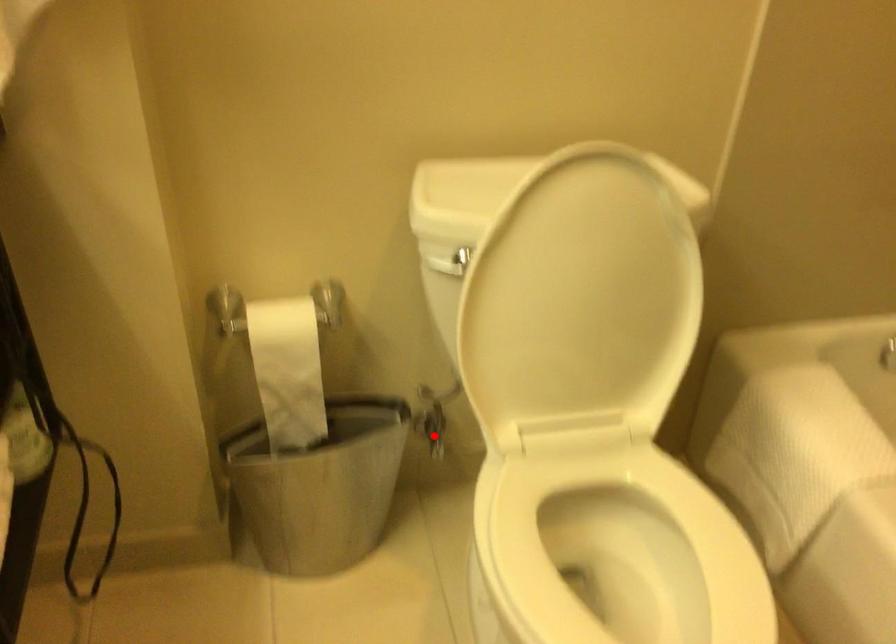
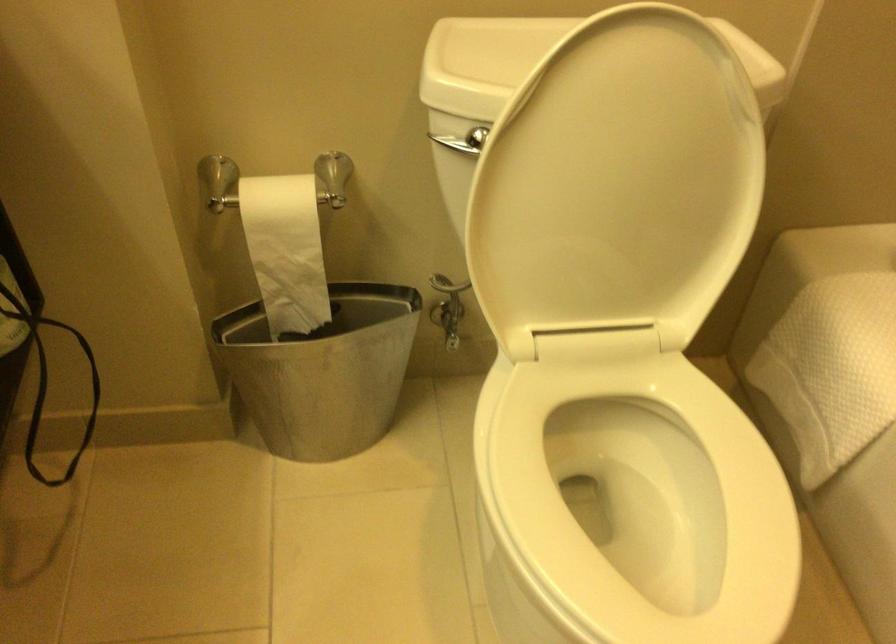
In the second image, find the point that corresponds to the highlighted location in the first image.

(449, 325)